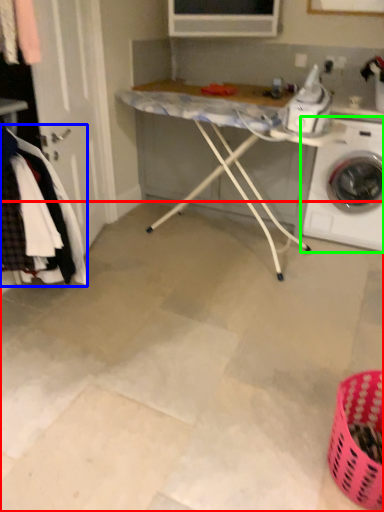
Question: Which is farther away from concrete (highlighted by a red box)? clothing (highlighted by a blue box) or washing machine (highlighted by a green box)?

Choices:
 (A) clothing
 (B) washing machine

Answer: (B)